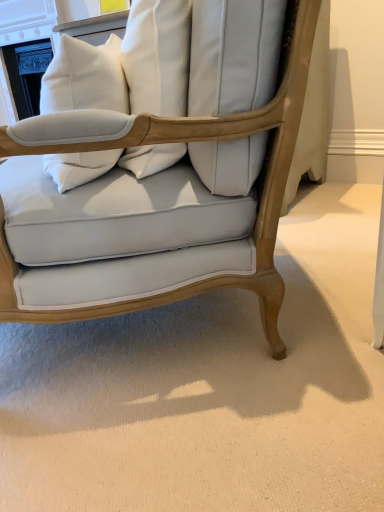
Question: Should I look upward or downward to see light beige wood chair at center?

Choices:
 (A) up
 (B) down

Answer: (A)